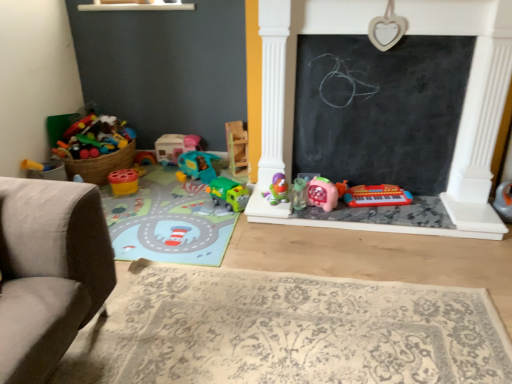
Where is `pink plastic clock at center-right, which is the eighth toy from left to right`? Image resolution: width=512 pixels, height=384 pixels. pink plastic clock at center-right, which is the eighth toy from left to right is located at coordinates (322, 194).

The width and height of the screenshot is (512, 384). In order to click on red plastic keyboard at lower center, the ninth toy when ordered from left to right in this screenshot , I will do `click(377, 196)`.

What are the coordinates of `matte plastic toy at center, which is the 6th toy from left to right` in the screenshot? It's located at (277, 190).

What do you see at coordinates (504, 201) in the screenshot? I see `white plastic toy at right, marked as the 10th toy in a left-to-right arrangement` at bounding box center [504, 201].

Find the location of a particular element. The width and height of the screenshot is (512, 384). teal plastic toy car at center, which appears as the 3th toy when viewed from the left is located at coordinates (197, 166).

Where is `matte plastic cup at center-left, acting as the 10th toy starting from the right`? The image size is (512, 384). matte plastic cup at center-left, acting as the 10th toy starting from the right is located at coordinates [x=123, y=181].

Can you tell me how much matte plastic toy at center, acting as the fifth toy starting from the right, and green plastic truck at center, the seventh toy viewed from the right, differ in facing direction?

30 degrees.

Considering the relative sizes of matte plastic toy at center, which is the 6th toy from left to right, and green plastic truck at center, the seventh toy viewed from the right, in the image provided, is matte plastic toy at center, which is the 6th toy from left to right, shorter than green plastic truck at center, the seventh toy viewed from the right,?

Yes.

From a real-world perspective, which toy is the 7th one above the green plastic truck at center, which ranks as the 4th toy in left-to-right order? Please provide its 2D coordinates.

[(277, 190)]

Which object is positioned more to the left, matte plastic toy at center, which is the 6th toy from left to right, or green plastic truck at center, the seventh toy viewed from the right?

From the viewer's perspective, green plastic truck at center, the seventh toy viewed from the right, appears more on the left side.

Is wooden block at center, marked as the fifth toy in a left-to-right arrangement, far from matte plastic toy at center, acting as the fifth toy starting from the right?

No, there isn't a large distance between wooden block at center, marked as the fifth toy in a left-to-right arrangement, and matte plastic toy at center, acting as the fifth toy starting from the right.

From the image's perspective, which is above, wooden block at center, positioned as the sixth toy in right-to-left order, or matte plastic toy at center, acting as the fifth toy starting from the right?

wooden block at center, positioned as the sixth toy in right-to-left order, appears higher in the image.

Which object is positioned more to the left, wooden block at center, marked as the fifth toy in a left-to-right arrangement, or matte plastic toy at center, which is the 6th toy from left to right?

Positioned to the left is wooden block at center, marked as the fifth toy in a left-to-right arrangement.

This screenshot has width=512, height=384. Find the location of `the 7th toy positioned below the matte plastic toy at center, which is the 6th toy from left to right (from a real-world perspective)`. the 7th toy positioned below the matte plastic toy at center, which is the 6th toy from left to right (from a real-world perspective) is located at coordinates (228, 194).

From the image's perspective, which is above, green plastic truck at center, the seventh toy viewed from the right, or matte plastic toy at center, which is the 6th toy from left to right?

matte plastic toy at center, which is the 6th toy from left to right, from the image's perspective.

Is green plastic truck at center, the seventh toy viewed from the right, turned away from matte plastic toy at center, which is the 6th toy from left to right?

No, green plastic truck at center, the seventh toy viewed from the right,'s orientation is not away from matte plastic toy at center, which is the 6th toy from left to right.

Considering the relative sizes of pink plastic clock at center-right, which ranks as the 3th toy in right-to-left order, and carpeted play mat at lower left, which is the second mat from front to back, in the image provided, is pink plastic clock at center-right, which ranks as the 3th toy in right-to-left order, bigger than carpeted play mat at lower left, which is the second mat from front to back,?

Actually, pink plastic clock at center-right, which ranks as the 3th toy in right-to-left order, might be smaller than carpeted play mat at lower left, which is the second mat from front to back.

Is pink plastic clock at center-right, which ranks as the 3th toy in right-to-left order, located outside carpeted play mat at lower left, acting as the 1th mat starting from the back?

pink plastic clock at center-right, which ranks as the 3th toy in right-to-left order, lies outside carpeted play mat at lower left, acting as the 1th mat starting from the back,'s area.

From the image's perspective, is pink plastic clock at center-right, which ranks as the 3th toy in right-to-left order, on top of carpeted play mat at lower left, which ranks as the 2th mat in bottom-to-top order?

Yes.

From a real-world perspective, is pink plastic clock at center-right, which ranks as the 3th toy in right-to-left order, over carpeted play mat at lower left, acting as the 1th mat starting from the back?

Yes.

From the image's perspective, relative to red plastic keyboard at lower center, the ninth toy when ordered from left to right, is green plastic truck at center, which ranks as the 4th toy in left-to-right order, above or below?

green plastic truck at center, which ranks as the 4th toy in left-to-right order, is situated higher than red plastic keyboard at lower center, the ninth toy when ordered from left to right, in the image.

Considering the positions of point (225, 177) and point (347, 194), is point (225, 177) closer or farther from the camera than point (347, 194)?

Point (225, 177) is farther from the camera than point (347, 194).

Is green plastic truck at center, which ranks as the 4th toy in left-to-right order, positioned far away from red plastic keyboard at lower center, which is the 2th toy in right-to-left order?

That's not correct — green plastic truck at center, which ranks as the 4th toy in left-to-right order, is a little close to red plastic keyboard at lower center, which is the 2th toy in right-to-left order.

Which of these two, green plastic truck at center, the seventh toy viewed from the right, or red plastic keyboard at lower center, the ninth toy when ordered from left to right, is smaller?

green plastic truck at center, the seventh toy viewed from the right.

Is matte plastic toy car at center, the 9th toy when ordered from right to left, at the right side of red plastic keyboard at lower center, which is the 2th toy in right-to-left order?

No.

Looking at their sizes, would you say matte plastic toy car at center, the 9th toy when ordered from right to left, is wider or thinner than red plastic keyboard at lower center, which is the 2th toy in right-to-left order?

Considering their sizes, matte plastic toy car at center, the 9th toy when ordered from right to left, looks slimmer than red plastic keyboard at lower center, which is the 2th toy in right-to-left order.

Image resolution: width=512 pixels, height=384 pixels. Find the location of `toy that is the 8th object located below the matte plastic toy car at center, the 9th toy when ordered from right to left (from the image's perspective)`. toy that is the 8th object located below the matte plastic toy car at center, the 9th toy when ordered from right to left (from the image's perspective) is located at coordinates (377, 196).

Relative to red plastic keyboard at lower center, which is the 2th toy in right-to-left order, is matte plastic toy car at center, the 2th toy from the left, in front or behind?

Clearly, matte plastic toy car at center, the 2th toy from the left, is behind red plastic keyboard at lower center, which is the 2th toy in right-to-left order.

Considering the relative positions of matte plastic toy at center, acting as the fifth toy starting from the right, and wooden block at center, marked as the fifth toy in a left-to-right arrangement, in the image provided, is matte plastic toy at center, acting as the fifth toy starting from the right, to the left or to the right of wooden block at center, marked as the fifth toy in a left-to-right arrangement,?

Based on their positions, matte plastic toy at center, acting as the fifth toy starting from the right, is located to the right of wooden block at center, marked as the fifth toy in a left-to-right arrangement.

What are the coordinates of `the 4th toy behind the matte plastic toy at center, acting as the fifth toy starting from the right, counting from the anchor's position` in the screenshot? It's located at (237, 146).

From the image's perspective, is matte plastic toy at center, acting as the fifth toy starting from the right, beneath wooden block at center, marked as the fifth toy in a left-to-right arrangement?

Yes, from the image's perspective, matte plastic toy at center, acting as the fifth toy starting from the right, is below wooden block at center, marked as the fifth toy in a left-to-right arrangement.

This screenshot has width=512, height=384. Find the location of `toy that is the 1st one when counting forward from the green plastic truck at center, which ranks as the 4th toy in left-to-right order`. toy that is the 1st one when counting forward from the green plastic truck at center, which ranks as the 4th toy in left-to-right order is located at coordinates (277, 190).

In order to click on toy that is the 1st one when counting leftward from the matte plastic toy at center, which is the 6th toy from left to right in this screenshot , I will do `click(237, 146)`.

Consider the image. Which object lies nearer to the anchor point carpeted play mat at lower left, the 1th mat from the top, matte plastic toy at center, acting as the fifth toy starting from the right, or teal plastic toy car at center, which appears as the 3th toy when viewed from the left?

teal plastic toy car at center, which appears as the 3th toy when viewed from the left, lies closer to carpeted play mat at lower left, the 1th mat from the top, than the other object.

Consider the image. Which object lies further to the anchor point matte plastic toy car at center, the 9th toy when ordered from right to left, black chalkboard at center or teal plastic toy car at center, the eighth toy viewed from the right?

Based on the image, black chalkboard at center appears to be further to matte plastic toy car at center, the 9th toy when ordered from right to left.

Which object lies further to the anchor point wooden block at center, positioned as the sixth toy in right-to-left order, clear plastic sippy cup at center, which ranks as the 7th toy in left-to-right order, or teal plastic toy car at center, the eighth toy viewed from the right?

clear plastic sippy cup at center, which ranks as the 7th toy in left-to-right order, is positioned further to the anchor wooden block at center, positioned as the sixth toy in right-to-left order.

Which object lies further to the anchor point green plastic truck at center, which ranks as the 4th toy in left-to-right order, red plastic keyboard at lower center, which is the 2th toy in right-to-left order, or matte plastic toy car at center, the 2th toy from the left?

red plastic keyboard at lower center, which is the 2th toy in right-to-left order, is further to green plastic truck at center, which ranks as the 4th toy in left-to-right order.

Estimate the real-world distances between objects in this image. Which object is closer to beige textured rug at lower center, the 1th mat from the bottom, matte plastic toy car at center, the 9th toy when ordered from right to left, or green plastic truck at center, which ranks as the 4th toy in left-to-right order?

green plastic truck at center, which ranks as the 4th toy in left-to-right order, is closer to beige textured rug at lower center, the 1th mat from the bottom.

Estimate the real-world distances between objects in this image. Which object is closer to white plastic toy at right, marked as the 10th toy in a left-to-right arrangement, matte plastic toy at center, acting as the fifth toy starting from the right, or teal plastic toy car at center, which appears as the 3th toy when viewed from the left?

Among the two, matte plastic toy at center, acting as the fifth toy starting from the right, is located nearer to white plastic toy at right, marked as the 10th toy in a left-to-right arrangement.

Looking at the image, which one is located further to matte plastic cup at center-left, acting as the 10th toy starting from the right, matte plastic toy at center, which is the 6th toy from left to right, or clear plastic sippy cup at center, which ranks as the 7th toy in left-to-right order?

The object further to matte plastic cup at center-left, acting as the 10th toy starting from the right, is clear plastic sippy cup at center, which ranks as the 7th toy in left-to-right order.

Which object lies further to the anchor point pink plastic clock at center-right, which ranks as the 3th toy in right-to-left order, white plastic toy at right, marked as the 10th toy in a left-to-right arrangement, or matte plastic toy car at center, the 9th toy when ordered from right to left?

Based on the image, matte plastic toy car at center, the 9th toy when ordered from right to left, appears to be further to pink plastic clock at center-right, which ranks as the 3th toy in right-to-left order.

The image size is (512, 384). Identify the location of bulletin board between beige textured rug at lower center, the 1th mat positioned from the front, and wooden block at center, positioned as the sixth toy in right-to-left order, along the z-axis. (380, 109).

This screenshot has height=384, width=512. I want to click on bulletin board between beige textured rug at lower center, which is the second mat from back to front, and pink plastic clock at center-right, which is the eighth toy from left to right, along the z-axis, so click(380, 109).

This screenshot has height=384, width=512. What are the coordinates of `mat between carpeted play mat at lower left, which is the second mat from front to back, and white plastic toy at right, marked as the 10th toy in a left-to-right arrangement` in the screenshot? It's located at (287, 331).

The height and width of the screenshot is (384, 512). What are the coordinates of `bulletin board between wooden block at center, marked as the fifth toy in a left-to-right arrangement, and red plastic keyboard at lower center, the ninth toy when ordered from left to right` in the screenshot? It's located at (380, 109).